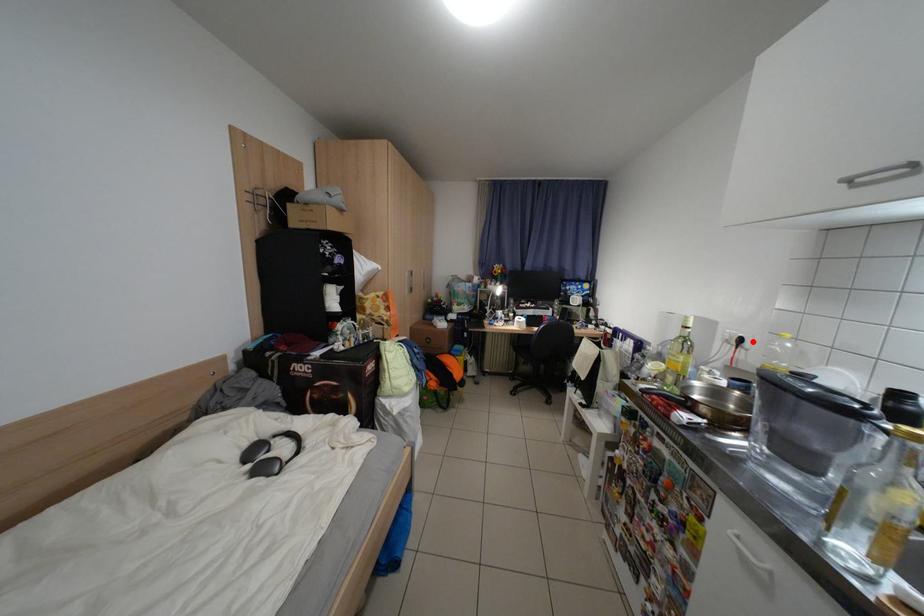
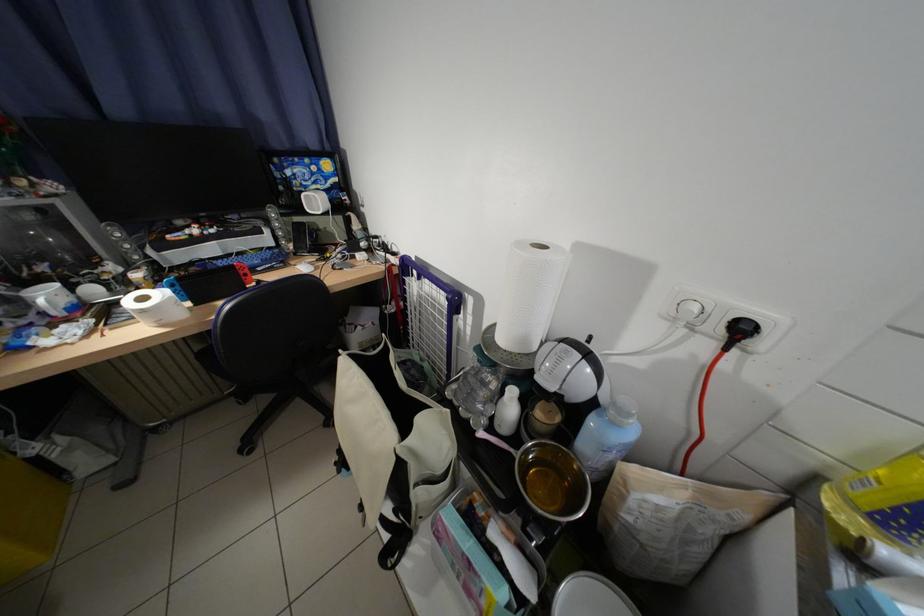
The point at the highlighted location is marked in the first image. Where is the corresponding point in the second image?

(754, 331)